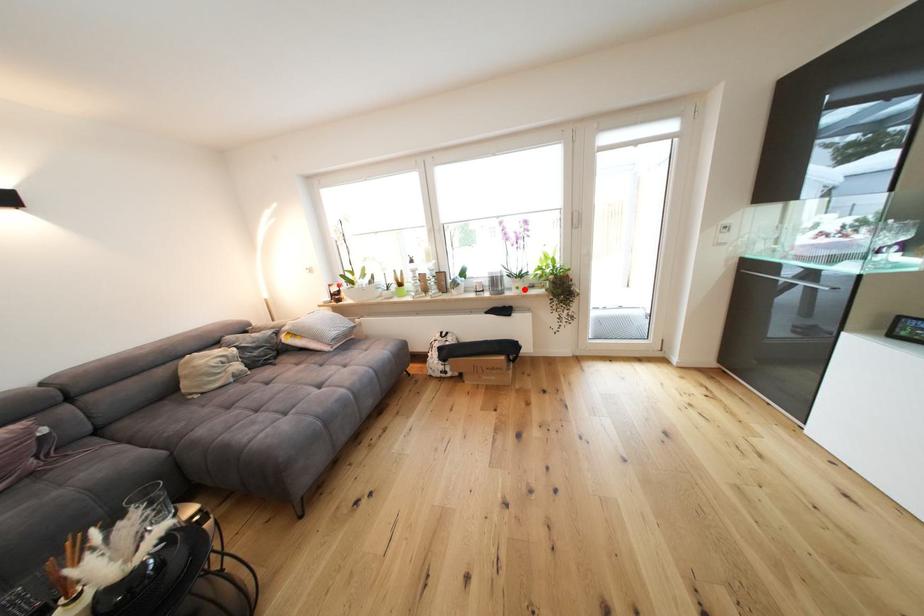
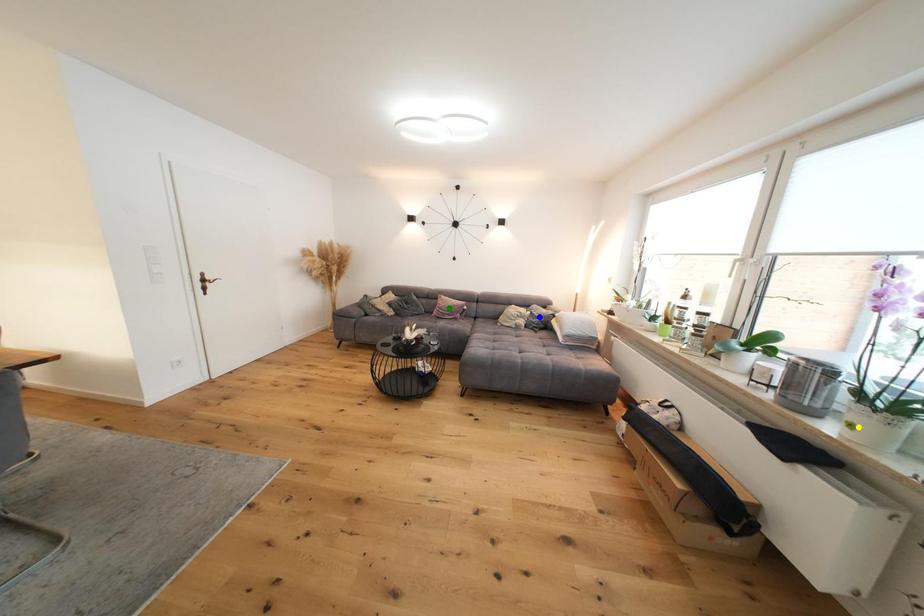
Question: I am providing you with two images of the same scene from different viewpoints. A red point is marked on the first image. You are given multiple points on the second image. Which point in image 2 is actually the same real-world point as the red point in image 1?

Choices:
 (A) green point
 (B) blue point
 (C) yellow point

Answer: (C)